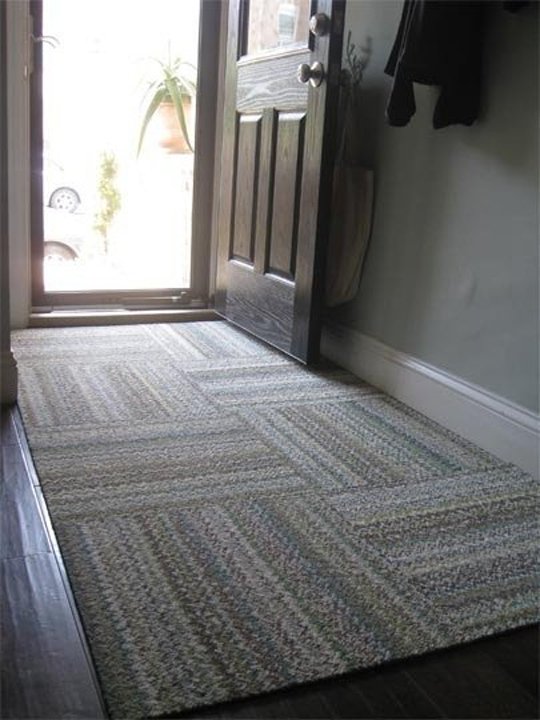
Locate an element on the screen. furthest carpet square is located at coordinates (209, 335).